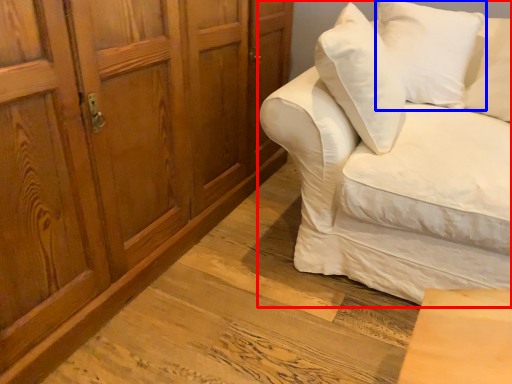
Question: Which of the following is the farthest to the observer, studio couch (highlighted by a red box) or pillow (highlighted by a blue box)?

Choices:
 (A) studio couch
 (B) pillow

Answer: (B)